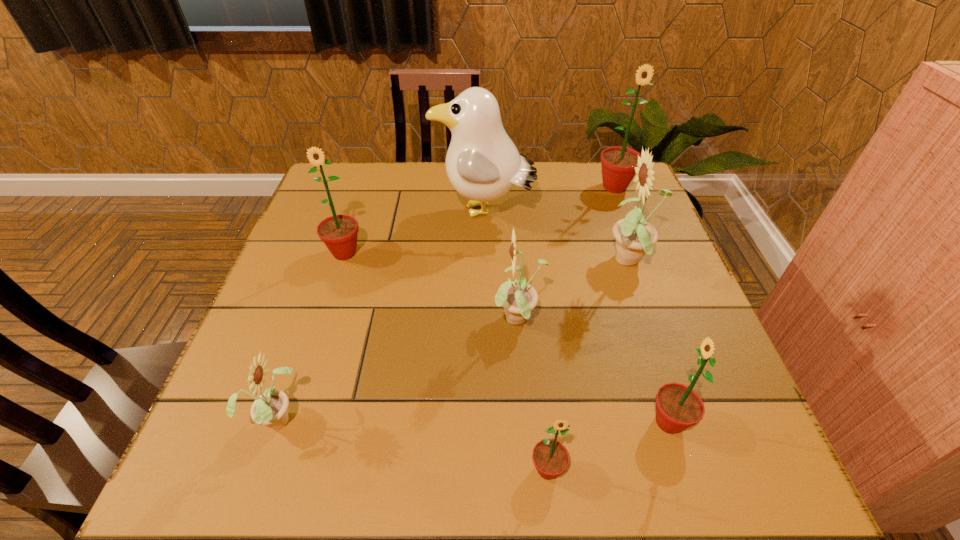
Where is `the tallest sunflower`? The height and width of the screenshot is (540, 960). the tallest sunflower is located at coordinates (618, 164).

You are a GUI agent. You are given a task and a screenshot of the screen. Output one action in this format:
    pyautogui.click(x=<x>, y=<y>)
    Task: Click on the farthest sunflower
    This screenshot has height=540, width=960.
    Given the screenshot: What is the action you would take?
    618,164

I want to click on white gull, so click(482, 163).

The height and width of the screenshot is (540, 960). What are the coordinates of `the rightmost yellow sunflower` in the screenshot? It's located at (635, 237).

Identify the location of the farthest yellow sunflower. The width and height of the screenshot is (960, 540). (635, 237).

Locate an element on the screen. Image resolution: width=960 pixels, height=540 pixels. the third nearest green sunflower is located at coordinates (339, 233).

Locate an element on the screen. This screenshot has height=540, width=960. the leftmost green sunflower is located at coordinates (339, 233).

What are the coordinates of `the fifth farthest object` in the screenshot? It's located at (518, 298).

Identify the location of the fourth nearest sunflower. This screenshot has width=960, height=540. (518, 298).

The height and width of the screenshot is (540, 960). What are the coordinates of `the third farthest green sunflower` in the screenshot? It's located at (678, 407).